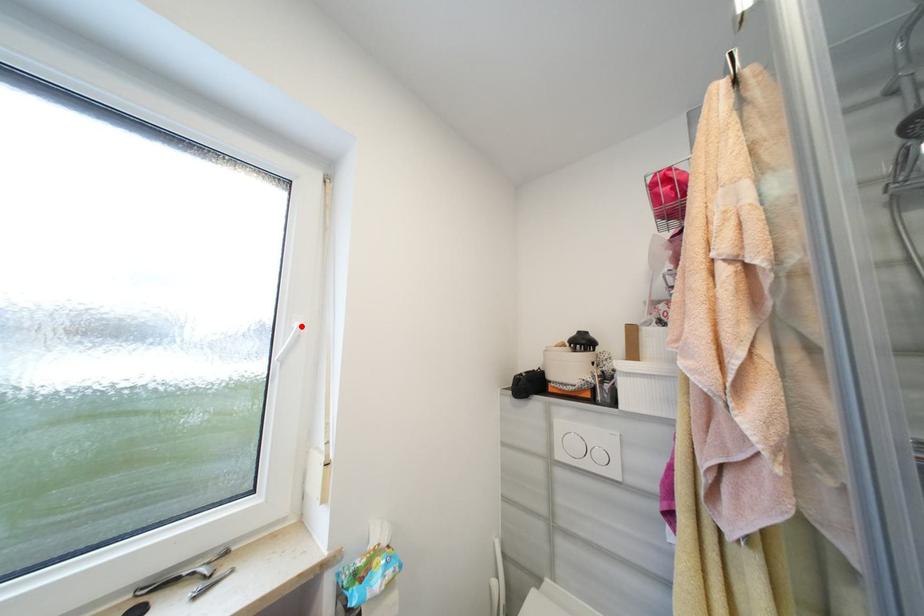
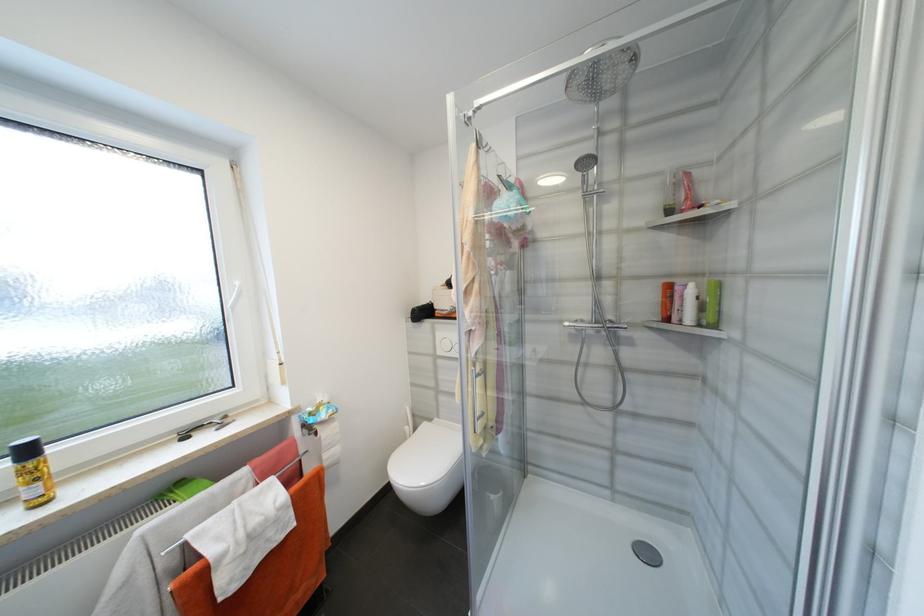
The point at the highlighted location is marked in the first image. Where is the corresponding point in the second image?

(242, 285)